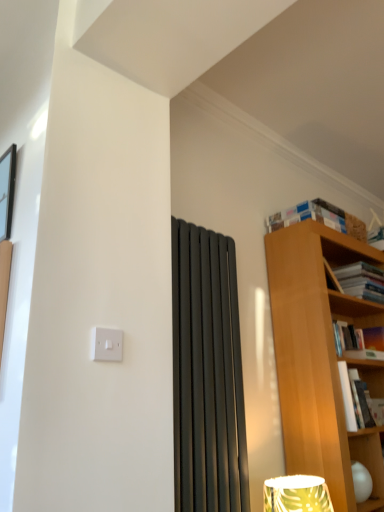
Question: Can you confirm if white paperbacks at upper right, arranged as the fourth book when ordered from the bottom, is bigger than hardcover book at upper right, which ranks as the third book in top-to-bottom order?

Choices:
 (A) yes
 (B) no

Answer: (A)

Question: Is white paperbacks at upper right, placed as the first book when sorted from top to bottom, aimed at hardcover book at upper right, the second book from the bottom?

Choices:
 (A) no
 (B) yes

Answer: (A)

Question: Is white paperbacks at upper right, arranged as the fourth book when ordered from the bottom, in front of hardcover book at upper right, the second book from the bottom?

Choices:
 (A) no
 (B) yes

Answer: (B)

Question: Can you confirm if white paperbacks at upper right, placed as the first book when sorted from top to bottom, is positioned to the left of hardcover book at upper right, the second book from the bottom?

Choices:
 (A) no
 (B) yes

Answer: (B)

Question: Does white paperbacks at upper right, arranged as the fourth book when ordered from the bottom, have a lesser height compared to hardcover book at upper right, the second book from the bottom?

Choices:
 (A) yes
 (B) no

Answer: (A)

Question: From a real-world perspective, relative to black glass picture frame at upper left, is hardcover book at right, the 4th book viewed from the top, vertically above or below?

Choices:
 (A) above
 (B) below

Answer: (B)

Question: Based on their sizes in the image, would you say hardcover book at right, the 4th book viewed from the top, is bigger or smaller than black glass picture frame at upper left?

Choices:
 (A) big
 (B) small

Answer: (A)

Question: Does point (354, 379) appear closer or farther from the camera than point (6, 217)?

Choices:
 (A) closer
 (B) farther

Answer: (B)

Question: Is hardcover book at right, the 4th book viewed from the top, wider or thinner than black glass picture frame at upper left?

Choices:
 (A) wide
 (B) thin

Answer: (A)

Question: Considering the positions of white paperbacks at upper right, arranged as the fourth book when ordered from the bottom, and hardcover book at upper right, which ranks as the third book in bottom-to-top order, in the image, is white paperbacks at upper right, arranged as the fourth book when ordered from the bottom, bigger or smaller than hardcover book at upper right, which ranks as the third book in bottom-to-top order,?

Choices:
 (A) small
 (B) big

Answer: (A)

Question: Is point (322, 212) positioned closer to the camera than point (352, 278)?

Choices:
 (A) closer
 (B) farther

Answer: (A)

Question: From a real-world perspective, is white paperbacks at upper right, placed as the first book when sorted from top to bottom, above or below hardcover book at upper right, which ranks as the third book in bottom-to-top order?

Choices:
 (A) above
 (B) below

Answer: (A)

Question: Relative to hardcover book at upper right, arranged as the second book when viewed from the top, is white paperbacks at upper right, arranged as the fourth book when ordered from the bottom, in front or behind?

Choices:
 (A) front
 (B) behind

Answer: (A)

Question: Is point (352, 398) closer or farther from the camera than point (342, 214)?

Choices:
 (A) farther
 (B) closer

Answer: (B)

Question: Considering their positions, is hardcover book at right, the 4th book viewed from the top, located in front of or behind white paperbacks at upper right, arranged as the fourth book when ordered from the bottom?

Choices:
 (A) behind
 (B) front

Answer: (B)